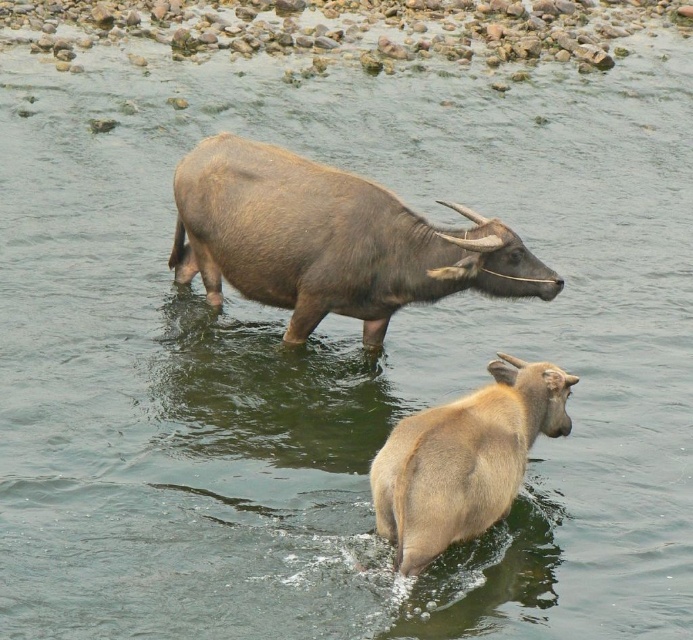
Is point (231, 220) positioned behind point (468, 515)?

That is True.

Does point (324, 240) come in front of point (421, 413)?

No.

Image resolution: width=693 pixels, height=640 pixels. Find the location of `brown matte bison at center`. brown matte bison at center is located at coordinates click(x=331, y=241).